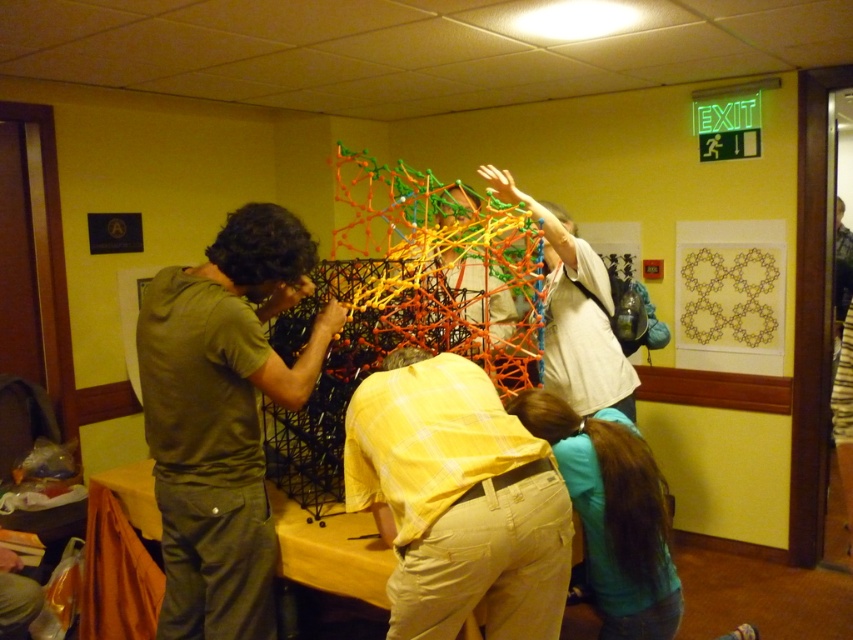
Does khaki pants at center come in front of yellow matte table at center?

Yes, khaki pants at center is in front of yellow matte table at center.

Which is in front, point (518, 525) or point (143, 493)?

Point (518, 525)

Image resolution: width=853 pixels, height=640 pixels. I want to click on khaki pants at center, so click(x=457, y=500).

How much distance is there between khaki pants at center and light beige fabric shirt at center?

A distance of 3.42 feet exists between khaki pants at center and light beige fabric shirt at center.

Can you confirm if khaki pants at center is thinner than light beige fabric shirt at center?

Indeed, khaki pants at center has a lesser width compared to light beige fabric shirt at center.

Does point (538, 490) lie behind point (581, 257)?

That is False.

What are the coordinates of `khaki pants at center` in the screenshot? It's located at (457, 500).

Who is more distant from viewer, (x=254, y=227) or (x=461, y=490)?

The point (x=254, y=227) is behind.

Can you confirm if matte green shirt at left is thinner than khaki pants at center?

Incorrect, matte green shirt at left's width is not less than khaki pants at center's.

Between point (189, 451) and point (541, 545), which one is positioned in front?

Point (541, 545) is in front.

Locate an element on the screen. matte green shirt at left is located at coordinates (223, 417).